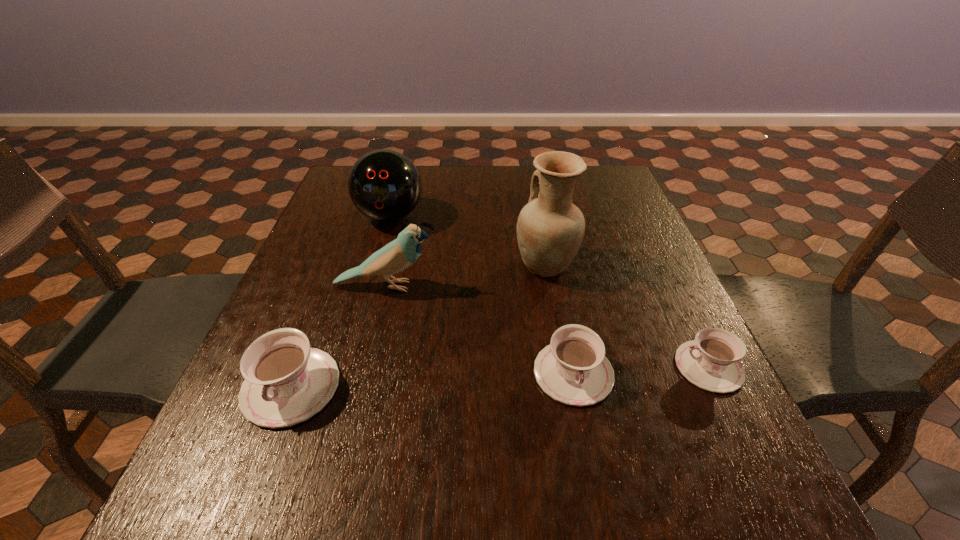
To achieve even spacing by inserting another teacup among them, please point to a vacant spot for this new teacup. Please provide its 2D coordinates. Your answer should be formatted as a tuple, i.e. [(x, y)], where the tuple contains the x and y coordinates of a point satisfying the conditions above.

[(434, 380)]